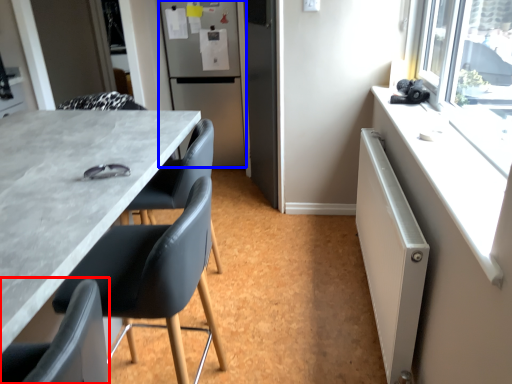
Question: Which object appears farthest to the camera in this image, chair (highlighted by a red box) or refrigerator (highlighted by a blue box)?

Choices:
 (A) chair
 (B) refrigerator

Answer: (B)